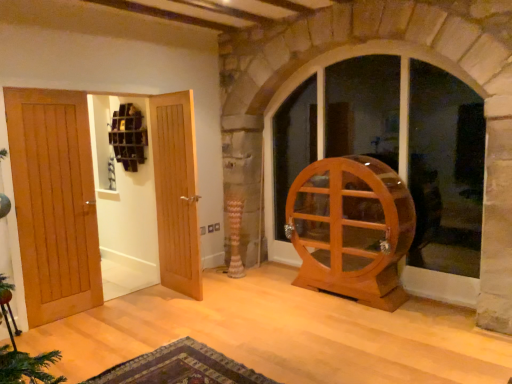
The height and width of the screenshot is (384, 512). I want to click on vacant space in front of light brown wood door at center, marked as the 1th door in a right-to-left arrangement, so click(164, 308).